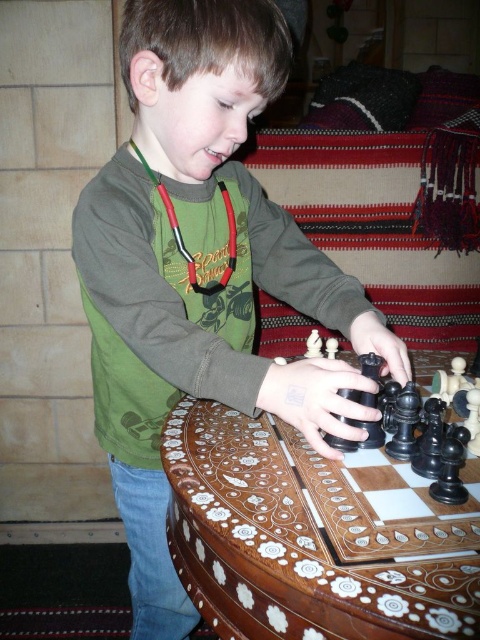
Question: Among these objects, which one is nearest to the camera?

Choices:
 (A) black glossy chess piece at center
 (B) inlaid wood chessboard at center

Answer: (B)

Question: Is green matte shirt at center thinner than black glossy chess piece at center?

Choices:
 (A) yes
 (B) no

Answer: (B)

Question: Which of these objects is positioned closest to the green matte shirt at center?

Choices:
 (A) inlaid wood chessboard at center
 (B) black glossy chess piece at center

Answer: (A)

Question: Which of these objects is positioned closest to the green matte shirt at center?

Choices:
 (A) black glossy chess piece at center
 (B) inlaid wood chessboard at center

Answer: (B)

Question: Is inlaid wood chessboard at center in front of black glossy chess piece at center?

Choices:
 (A) no
 (B) yes

Answer: (B)

Question: Can you confirm if green matte shirt at center is thinner than black glossy chess piece at center?

Choices:
 (A) yes
 (B) no

Answer: (B)